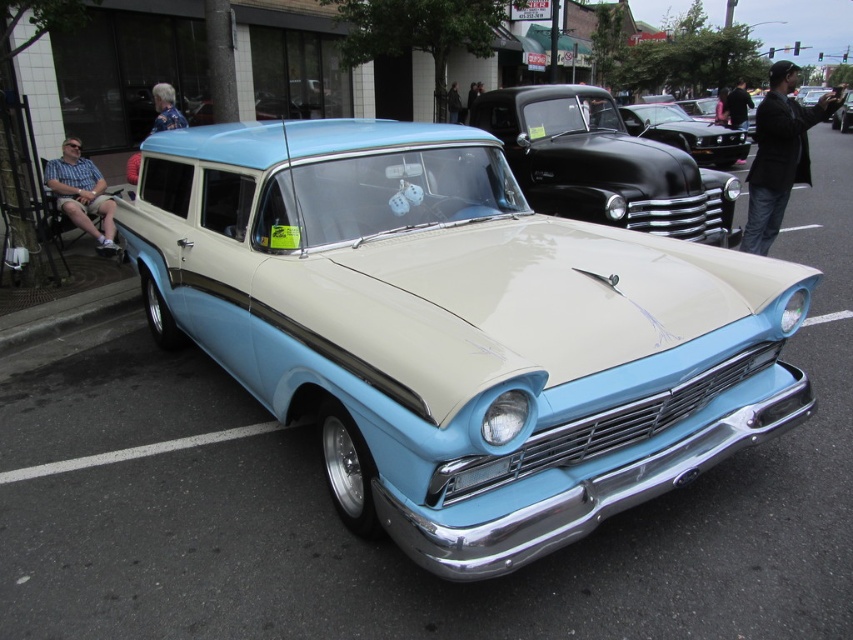
Question: Where is glossy black car at center located in relation to shiny black car at center in the image?

Choices:
 (A) left
 (B) right

Answer: (A)

Question: Is glossy black car at center to the right of shiny black car at center from the viewer's perspective?

Choices:
 (A) yes
 (B) no

Answer: (B)

Question: Which point is closer to the camera?

Choices:
 (A) shiny black car at center
 (B) glossy black car at center

Answer: (B)

Question: Can you confirm if glossy black car at center is positioned to the right of shiny black car at center?

Choices:
 (A) yes
 (B) no

Answer: (B)

Question: Which point is closer to the camera taking this photo?

Choices:
 (A) (544, 180)
 (B) (848, 104)
 (C) (635, 106)

Answer: (A)

Question: Which object appears closest to the camera in this image?

Choices:
 (A) shiny black car at center
 (B) glossy black car at center
 (C) light blue metallic car at center

Answer: (B)